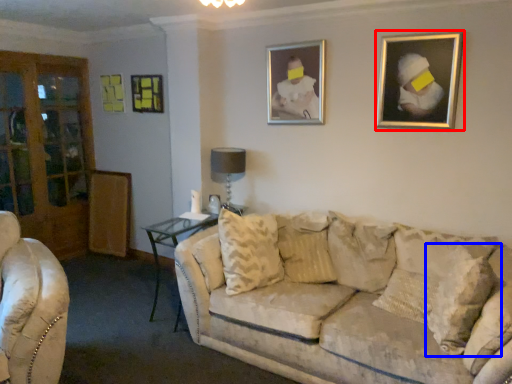
Question: Which point is further to the camera, picture frame (highlighted by a red box) or pillow (highlighted by a blue box)?

Choices:
 (A) picture frame
 (B) pillow

Answer: (A)